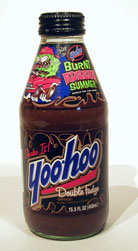
At what (x,y) coordinates should I click in order to perform the action: click on glass bottle. Please return your answer as a coordinate pair (x, y). Looking at the image, I should click on (97, 119).